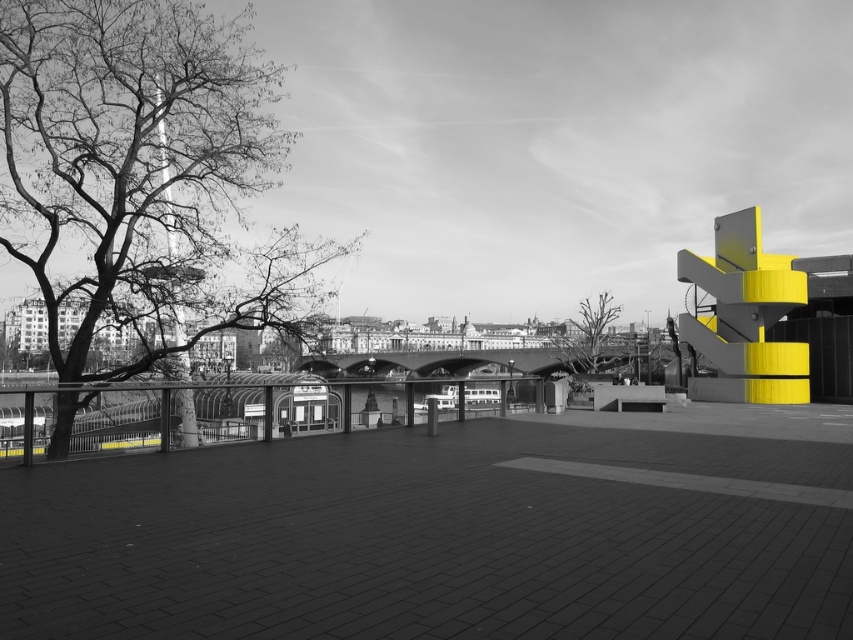
You are an urban planner analyzing this image. You notice two areas with bare branches at left and bare branches at center. Which area has more visual coverage from the branches?

The bare branches at center has more visual coverage than the bare branches at left.

You are an urban planner analyzing the layout of this area. You observe the bare branches at left and the bare branches at center in the image. Which of these two branches has a greater width?

The bare branches at center has a greater width than the bare branches at left.